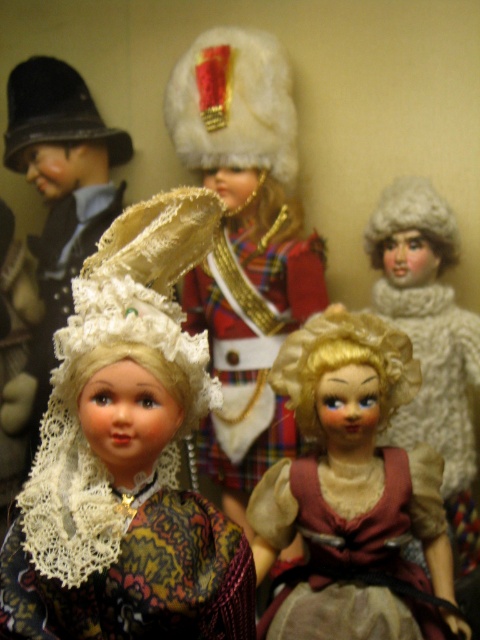
Question: Does white fur hat at center lie behind fuzzy white hat at upper right?

Choices:
 (A) yes
 (B) no

Answer: (B)

Question: Does lace fabric doll at center appear on the right side of white fur hat at center?

Choices:
 (A) yes
 (B) no

Answer: (B)

Question: Which point is farther to the camera?

Choices:
 (A) (336, 408)
 (B) (219, 131)
 (C) (55, 627)
 (D) (130, 468)

Answer: (B)

Question: Which object is farther from the camera taking this photo?

Choices:
 (A) lace fabric doll at center
 (B) white fur hat at center
 (C) fuzzy white hat at upper right

Answer: (C)

Question: Which object is positioned closest to the lace fabric doll at center?

Choices:
 (A) white fur hat at center
 (B) fuzzy white hat at upper right

Answer: (A)

Question: Is white fur hat at center above fuzzy white hat at upper right?

Choices:
 (A) yes
 (B) no

Answer: (A)